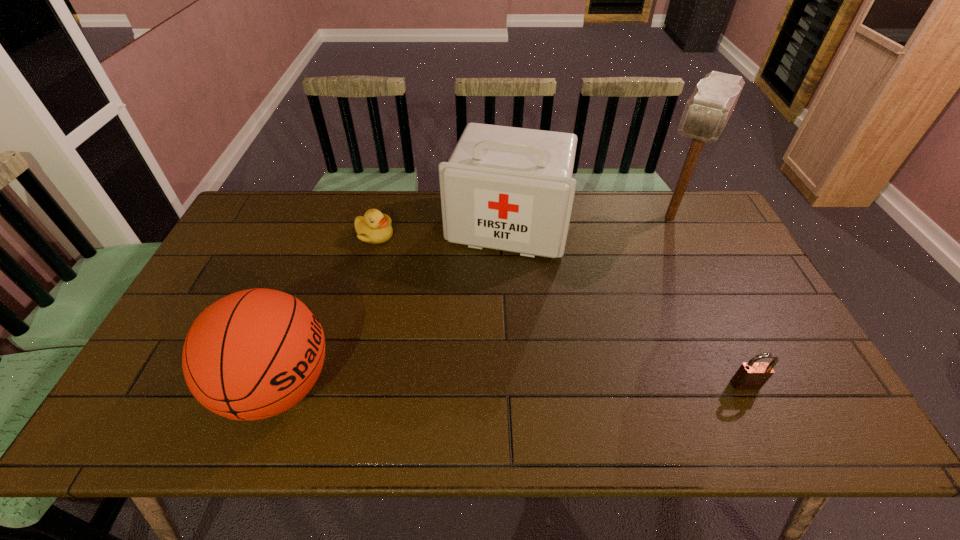
Identify the location of padlock situated at the near edge. (750, 376).

I want to click on padlock at the right edge, so click(750, 376).

Find the location of a particular element. This screenshot has height=540, width=960. mallet at the right edge is located at coordinates (707, 111).

Find the location of a particular element. The image size is (960, 540). object that is at the far right corner is located at coordinates (707, 111).

Locate an element on the screen. object that is at the near right corner is located at coordinates (750, 376).

Where is `free space at the far edge of the desktop`? The height and width of the screenshot is (540, 960). free space at the far edge of the desktop is located at coordinates (362, 210).

This screenshot has height=540, width=960. What are the coordinates of `vacant space at the near edge of the desktop` in the screenshot? It's located at (583, 382).

Find the location of a particular element. vacant space at the left edge of the desktop is located at coordinates (226, 265).

In the image, there is a desktop. At what (x,y) coordinates should I click in order to perform the action: click on vacant space at the far right corner. Please return your answer as a coordinate pair (x, y). The image size is (960, 540). Looking at the image, I should click on (707, 231).

Where is `vacant space at the near right corner of the desktop`? vacant space at the near right corner of the desktop is located at coordinates (797, 377).